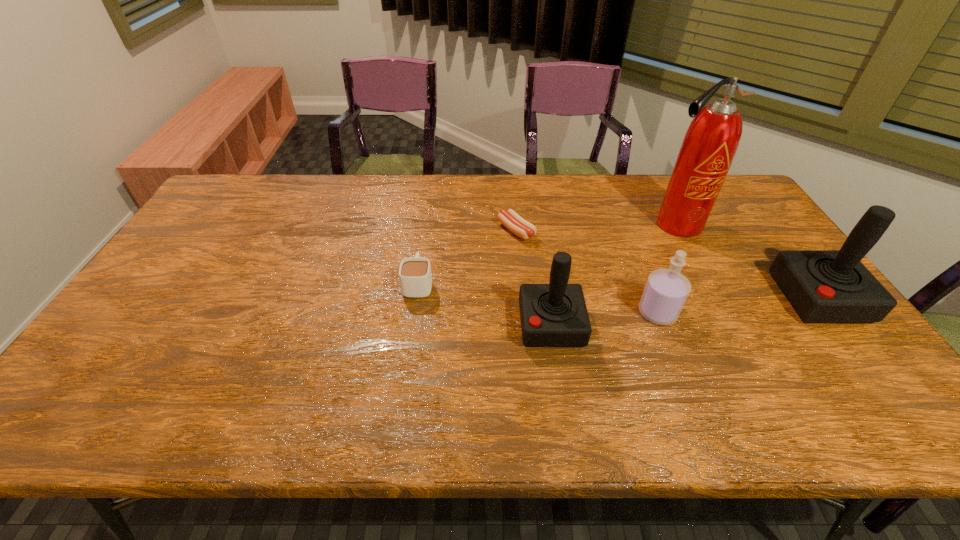
I want to click on vacant spot to place a joystick on the left, so click(251, 354).